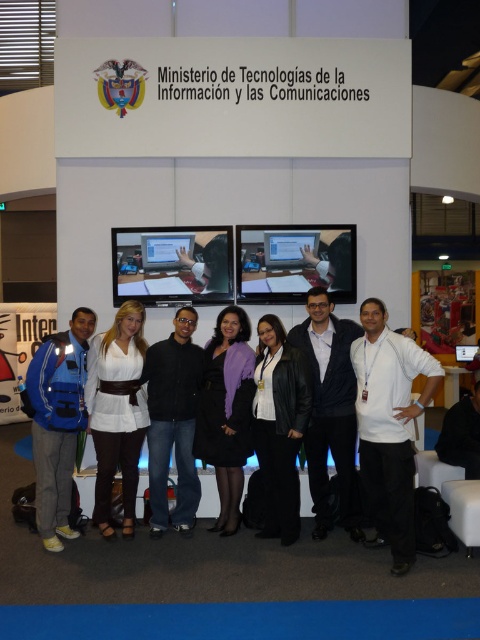
You are a photographer at the trade show and need to ensure all clothing items in the photo are visible. The white matte shirt at right and the black leather jacket at center are partially overlapping. Given their sizes, which clothing item might be more likely to be fully visible in the photo?

The white matte shirt at right has a larger size compared to the black leather jacket at center, so it is more likely to be fully visible in the photo since its larger size may cover less of the jacket or allow more of itself to remain visible despite overlapping.

You are a photographer at the trade show and need to adjust the lighting to ensure the white matte shirt at right is well lit. Given the shirt is at coordinates point 0.667, 0.810, which is closer to the edge or the center of the photo? Please answer based on the coordinates provided.

The white matte shirt at right is located at point (388, 426), which is closer to the edge of the photo since the coordinates are near the right side.

You are a photographer at the Ministry of Information Technologies and Communications event. You need to ensure that the white matte shirt at center and the purple matte jacket at center are visible in the photo. Based on their positions, which one is closer to the top of the image?

The white matte shirt at center is above the purple matte jacket at center, so it is closer to the top of the image.